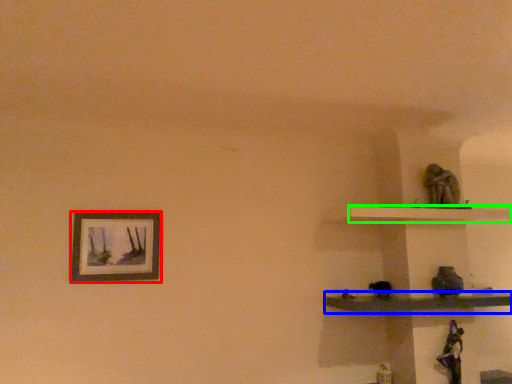
Question: Which object is the farthest from picture frame (highlighted by a red box)? Choose among these: shelf (highlighted by a blue box) or shelf (highlighted by a green box).

Choices:
 (A) shelf
 (B) shelf

Answer: (B)